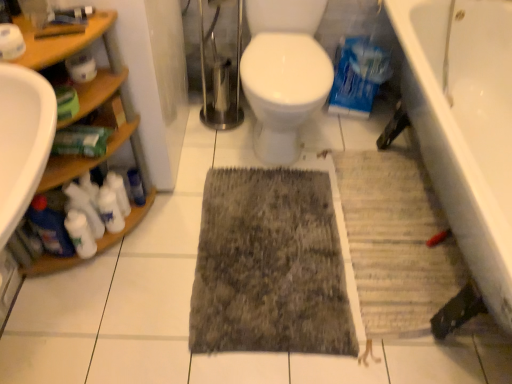
You are a GUI agent. You are given a task and a screenshot of the screen. Output one action in this format:
    pyautogui.click(x=<x>, y=<y>)
    Task: Click on the spots to the right of blue glossy bottle at left, the 4th cleaning product viewed from the right
    The image size is (512, 384).
    Given the screenshot: What is the action you would take?
    pyautogui.click(x=119, y=265)